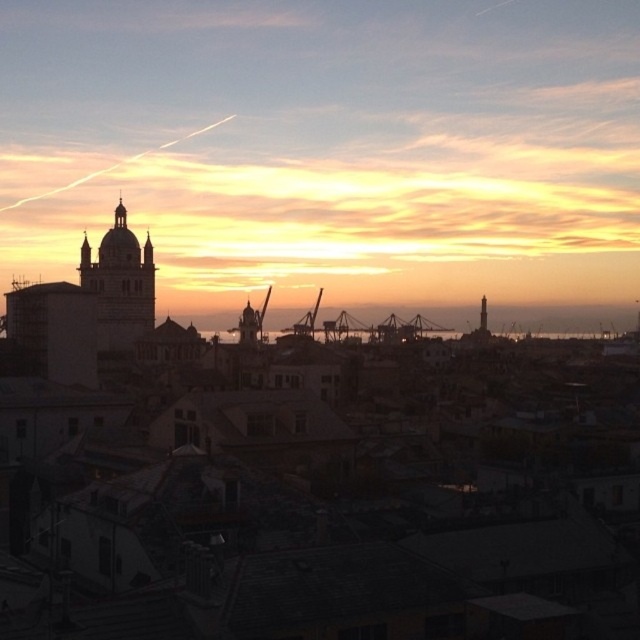
You are an architect reviewing a city planning proposal. You notice two cranes in the image, the metallic gray crane at center and the metallic industrial crane at center. Based on their positions in the scene, which one is closer to the foreground?

The metallic gray crane at center is located above the metallic industrial crane at center, meaning it is closer to the foreground.

Consider the image. You are an architect reviewing a city blueprint. You observe two cranes in the image, the metallic gray crane at center and the metallic industrial crane at center. Which one has a greater height according to the blueprint?

The metallic gray crane at center is much taller than the metallic industrial crane at center, so the metallic gray crane at center has a greater height according to the blueprint.

You are an architect reviewing a city model and notice two cranes in the distance. The metallic gray crane at center and the metallic industrial crane at center. Which one is closer to you?

The metallic gray crane at center is closer to you because it is further to the viewer than the metallic industrial crane at center.